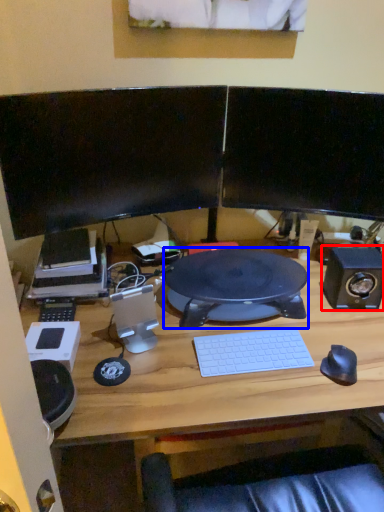
Question: Among these objects, which one is nearest to the camera, speaker (highlighted by a red box) or desktop (highlighted by a blue box)?

Choices:
 (A) speaker
 (B) desktop

Answer: (B)